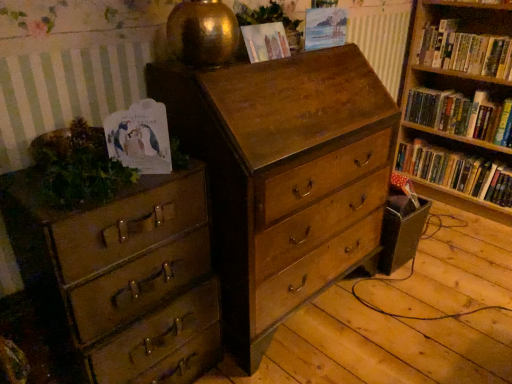
Identify the location of watercolor paper at upper center, the second paperback book from the left. The image size is (512, 384). (265, 41).

Measure the distance between point (x=272, y=1) and camera.

A distance of 4.96 feet exists between point (x=272, y=1) and camera.

What do you see at coordinates (456, 172) in the screenshot? I see `hardcover book at right, the 1th book positioned from the bottom` at bounding box center [456, 172].

You are a GUI agent. You are given a task and a screenshot of the screen. Output one action in this format:
    pyautogui.click(x=<x>, y=<y>)
    Task: Click on the matte brown chest of drawers at left, positioned as the 1th chest of drawers in left-to-right order
    The image size is (512, 384).
    Given the screenshot: What is the action you would take?
    pyautogui.click(x=123, y=276)

Locate an element on the screen. Image resolution: width=512 pixels, height=384 pixels. watercolor paper at upper center, which is counted as the second paperback book, starting from the front is located at coordinates (265, 41).

From a real-world perspective, relative to matte paper at upper center, placed as the third paperback book when sorted from front to back, is white paper at left, positioned as the third paperback book in back-to-front order, vertically above or below?

white paper at left, positioned as the third paperback book in back-to-front order, is situated lower than matte paper at upper center, placed as the third paperback book when sorted from front to back, in the real world.

From the image's perspective, which object appears higher, white paper at left, positioned as the third paperback book in back-to-front order, or matte paper at upper center, which is counted as the first paperback book, starting from the right?

matte paper at upper center, which is counted as the first paperback book, starting from the right, from the image's perspective.

In order to click on paperback book that is the 2nd one when counting upward from the white paper at left, which is the 1th paperback book from front to back (from the image's perspective) in this screenshot , I will do `click(325, 28)`.

Who is more distant, matte brown chest of drawers at left, positioned as the 1th chest of drawers in left-to-right order, or hardcover book at right, placed as the second book when sorted from bottom to top?

hardcover book at right, placed as the second book when sorted from bottom to top, is behind.

What are the coordinates of `the 2nd chest of drawers to the left when counting from the hardcover book at right, acting as the second book starting from the top` in the screenshot? It's located at (123, 276).

From the image's perspective, which is below, matte brown chest of drawers at left, positioned as the 1th chest of drawers in left-to-right order, or hardcover book at right, acting as the second book starting from the top?

From the image's view, matte brown chest of drawers at left, positioned as the 1th chest of drawers in left-to-right order, is below.

Is matte brown chest of drawers at left, positioned as the 1th chest of drawers in left-to-right order, turned away from hardcover book at right, placed as the second book when sorted from bottom to top?

No.

Identify the location of the 2nd paperback book behind the wooden chest of drawers at center, which is the 1th chest of drawers from right to left. This screenshot has height=384, width=512. (325, 28).

Does point (337, 16) come in front of point (365, 245)?

Yes.

Relative to wooden chest of drawers at center, the second chest of drawers viewed from the left, is matte paper at upper center, placed as the third paperback book when sorted from front to back, in front or behind?

Visually, matte paper at upper center, placed as the third paperback book when sorted from front to back, is located behind wooden chest of drawers at center, the second chest of drawers viewed from the left.

Which of these two, matte paper at upper center, the 3th paperback book positioned from the bottom, or wooden chest of drawers at center, the second chest of drawers viewed from the left, stands taller?

wooden chest of drawers at center, the second chest of drawers viewed from the left.

From the picture: From a real-world perspective, is hardcover book at right, which is the 3th book from bottom to top, on top of matte paper at upper center, the 3th paperback book positioned from the bottom?

No.

Is matte paper at upper center, the first paperback book from the top, a part of hardcover book at right, positioned as the 1th book in top-to-bottom order?

That's incorrect, matte paper at upper center, the first paperback book from the top, is not inside hardcover book at right, positioned as the 1th book in top-to-bottom order.

Which of these two, hardcover book at right, positioned as the 1th book in top-to-bottom order, or matte paper at upper center, marked as the first paperback book in a back-to-front arrangement, is wider?

hardcover book at right, positioned as the 1th book in top-to-bottom order, is wider.

From the image's perspective, is hardcover book at right, which is the 3th book from bottom to top, above matte paper at upper center, which is counted as the first paperback book, starting from the right?

Yes.

Can you confirm if green leafy plant at left, placed as the 1th plant when sorted from bottom to top, is bigger than wooden chest of drawers at center, which is the 1th chest of drawers from right to left?

No, green leafy plant at left, placed as the 1th plant when sorted from bottom to top, is not bigger than wooden chest of drawers at center, which is the 1th chest of drawers from right to left.

Is green leafy plant at left, placed as the 1th plant when sorted from bottom to top, next to wooden chest of drawers at center, which is the 1th chest of drawers from right to left, and touching it?

Result: green leafy plant at left, placed as the 1th plant when sorted from bottom to top, and wooden chest of drawers at center, which is the 1th chest of drawers from right to left, are clearly separated.

Is green leafy plant at left, which is the first plant from left to right, looking in the opposite direction of wooden chest of drawers at center, the second chest of drawers viewed from the left?

That's not correct — green leafy plant at left, which is the first plant from left to right, is not looking away from wooden chest of drawers at center, the second chest of drawers viewed from the left.

Would you say green leafy plant at left, the 1th plant viewed from the front, is to the left or to the right of wooden chest of drawers at center, the second chest of drawers viewed from the left, in the picture?

In the image, green leafy plant at left, the 1th plant viewed from the front, appears on the left side of wooden chest of drawers at center, the second chest of drawers viewed from the left.

Is matte brown chest of drawers at left, the second chest of drawers when ordered from right to left, outside of hardcover book at right, positioned as the 1th book in top-to-bottom order?

Yes, matte brown chest of drawers at left, the second chest of drawers when ordered from right to left, is not within hardcover book at right, positioned as the 1th book in top-to-bottom order.

Identify the location of the chest of drawers that is the 2nd one when counting downward from the hardcover book at right, which is the 3th book from bottom to top (from the image's perspective). Image resolution: width=512 pixels, height=384 pixels. (123, 276).

Is matte brown chest of drawers at left, positioned as the 1th chest of drawers in left-to-right order, turned away from hardcover book at right, positioned as the 1th book in top-to-bottom order?

No, matte brown chest of drawers at left, positioned as the 1th chest of drawers in left-to-right order, is not facing away from hardcover book at right, positioned as the 1th book in top-to-bottom order.

From the image's perspective, which is above, white paper at left, positioned as the third paperback book in back-to-front order, or green leafy plant at left, the 1th plant viewed from the front?

From the image's view, white paper at left, positioned as the third paperback book in back-to-front order, is above.

Can you confirm if white paper at left, acting as the first paperback book starting from the bottom, is positioned to the left of green leafy plant at left, which is the first plant from left to right?

No.

Is white paper at left, which is the 1th paperback book from front to back, bigger or smaller than green leafy plant at left, placed as the 1th plant when sorted from bottom to top?

Considering their sizes, white paper at left, which is the 1th paperback book from front to back, takes up less space than green leafy plant at left, placed as the 1th plant when sorted from bottom to top.

Is green leafy plant at left, marked as the second plant in a right-to-left arrangement, inside white paper at left, which is the 1th paperback book from front to back?

Definitely not — green leafy plant at left, marked as the second plant in a right-to-left arrangement, is not inside white paper at left, which is the 1th paperback book from front to back.

Starting from the matte paper at upper center, placed as the third paperback book when sorted from front to back, which paperback book is the 2nd one in front? Please provide its 2D coordinates.

[(140, 137)]

Identify the location of book that is the 2nd object located behind the matte brown chest of drawers at left, the second chest of drawers when ordered from right to left. (461, 114).

Based on the photo, looking at the image, which one is located closer to matte paper at upper center, the 3th paperback book positioned from the bottom, matte brown chest of drawers at left, positioned as the 1th chest of drawers in left-to-right order, or hardcover book at right, the third book from the top?

matte brown chest of drawers at left, positioned as the 1th chest of drawers in left-to-right order, is closer to matte paper at upper center, the 3th paperback book positioned from the bottom.

Which object lies nearer to the anchor point watercolor paper at upper center, the second paperback book from the left, hardcover book at right, placed as the second book when sorted from bottom to top, or matte paper at upper center, placed as the third paperback book when sorted from front to back?

matte paper at upper center, placed as the third paperback book when sorted from front to back.

Considering their positions, is matte brown chest of drawers at left, positioned as the 1th chest of drawers in left-to-right order, positioned further to green leafy plant at left, positioned as the 2th plant in back-to-front order, than hardcover book at right, acting as the second book starting from the top?

Based on the image, hardcover book at right, acting as the second book starting from the top, appears to be further to green leafy plant at left, positioned as the 2th plant in back-to-front order.

From the image, which object appears to be nearer to white paper at left, which is the 1th paperback book from front to back, hardcover book at right, placed as the second book when sorted from bottom to top, or watercolor paper at upper center, the second paperback book from the left?

The object closer to white paper at left, which is the 1th paperback book from front to back, is watercolor paper at upper center, the second paperback book from the left.

Consider the image. When comparing their distances from green leafy plant at upper center, the 1th plant viewed from the top, does wooden chest of drawers at center, which is the 1th chest of drawers from right to left, or white paper at left, positioned as the 3th paperback book in top-to-bottom order, seem further?

white paper at left, positioned as the 3th paperback book in top-to-bottom order, lies further to green leafy plant at upper center, the 1th plant viewed from the top, than the other object.

Which object lies further to the anchor point wooden chest of drawers at center, the second chest of drawers viewed from the left, hardcover book at right, the 1th book positioned from the bottom, or green leafy plant at left, which is the 2th plant in top-to-bottom order?

The object further to wooden chest of drawers at center, the second chest of drawers viewed from the left, is hardcover book at right, the 1th book positioned from the bottom.

Estimate the real-world distances between objects in this image. Which object is further from matte brown chest of drawers at left, positioned as the 1th chest of drawers in left-to-right order, watercolor paper at upper center, the second paperback book in the back-to-front sequence, or hardcover book at right, placed as the second book when sorted from bottom to top?

hardcover book at right, placed as the second book when sorted from bottom to top, is positioned further to the anchor matte brown chest of drawers at left, positioned as the 1th chest of drawers in left-to-right order.

When comparing their distances from matte paper at upper center, placed as the third paperback book when sorted from front to back, does white paper at left, the 3th paperback book viewed from the right, or matte brown chest of drawers at left, positioned as the 1th chest of drawers in left-to-right order, seem closer?

Among the two, white paper at left, the 3th paperback book viewed from the right, is located nearer to matte paper at upper center, placed as the third paperback book when sorted from front to back.

Where is `paperback book between wooden chest of drawers at center, which is the 1th chest of drawers from right to left, and hardcover book at right, positioned as the 1th book in top-to-bottom order, in the horizontal direction`? This screenshot has width=512, height=384. paperback book between wooden chest of drawers at center, which is the 1th chest of drawers from right to left, and hardcover book at right, positioned as the 1th book in top-to-bottom order, in the horizontal direction is located at coordinates (325, 28).

The height and width of the screenshot is (384, 512). Find the location of `plant between white paper at left, the 3th paperback book viewed from the right, and hardcover book at right, placed as the second book when sorted from bottom to top, from left to right`. plant between white paper at left, the 3th paperback book viewed from the right, and hardcover book at right, placed as the second book when sorted from bottom to top, from left to right is located at coordinates click(270, 20).

Where is `the chest of drawers located between watercolor paper at upper center, which is counted as the second paperback book, starting from the front, and hardcover book at right, positioned as the 1th book in top-to-bottom order, in the left-right direction`? The height and width of the screenshot is (384, 512). the chest of drawers located between watercolor paper at upper center, which is counted as the second paperback book, starting from the front, and hardcover book at right, positioned as the 1th book in top-to-bottom order, in the left-right direction is located at coordinates (284, 176).

Find the location of a particular element. Image resolution: width=512 pixels, height=384 pixels. plant between watercolor paper at upper center, the second paperback book from the left, and hardcover book at right, which is the 3th book from bottom to top, in the horizontal direction is located at coordinates (270, 20).